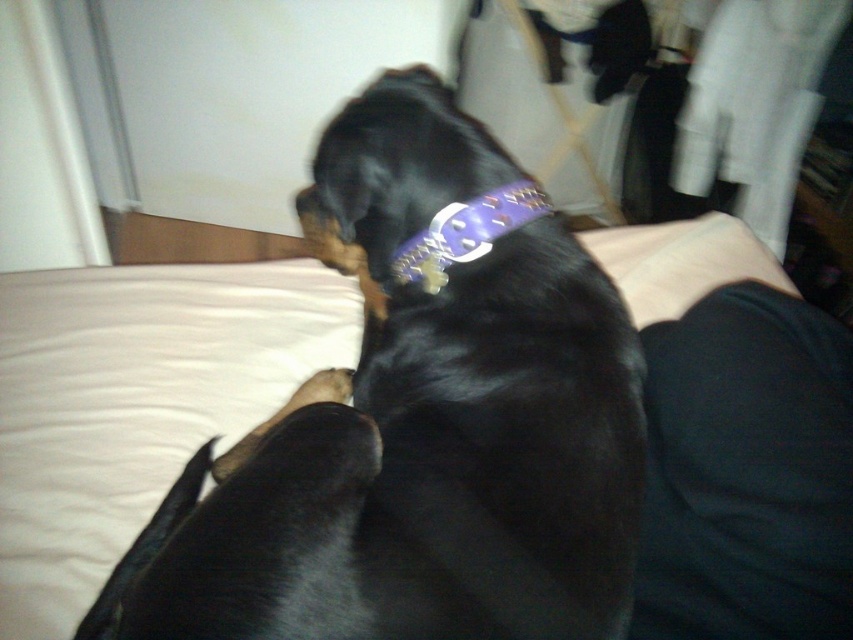
Question: Among these points, which one is nearest to the camera?

Choices:
 (A) click(531, 182)
 (B) click(306, 582)

Answer: (B)

Question: Which point is closer to the camera?

Choices:
 (A) purple leather neckband at center
 (B) black shiny fur dog at center

Answer: (B)

Question: Can you confirm if black shiny fur dog at center is positioned above dark fabric pants at lower right?

Choices:
 (A) no
 (B) yes

Answer: (B)

Question: Can you confirm if dark fabric pants at lower right is bigger than purple leather neckband at center?

Choices:
 (A) yes
 (B) no

Answer: (A)

Question: Estimate the real-world distances between objects in this image. Which object is closer to the purple leather neckband at center?

Choices:
 (A) dark fabric pants at lower right
 (B) black shiny fur dog at center

Answer: (B)

Question: Does black shiny fur dog at center appear under purple leather neckband at center?

Choices:
 (A) no
 (B) yes

Answer: (B)